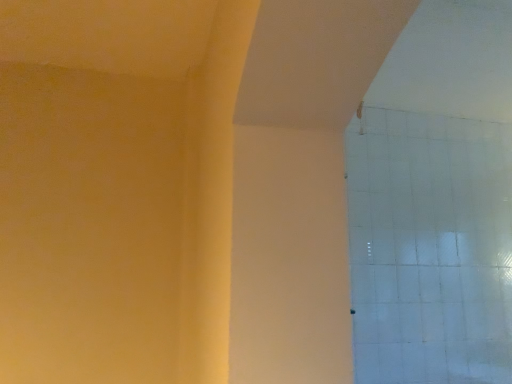
Question: Should I look upward or downward to see white glossy glass door at upper right?

Choices:
 (A) up
 (B) down

Answer: (B)